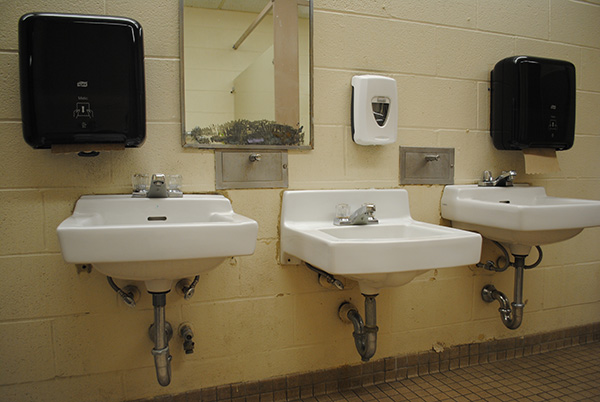
Where is `silver-gray j-shaped pipe`? The width and height of the screenshot is (600, 402). silver-gray j-shaped pipe is located at coordinates (516, 319).